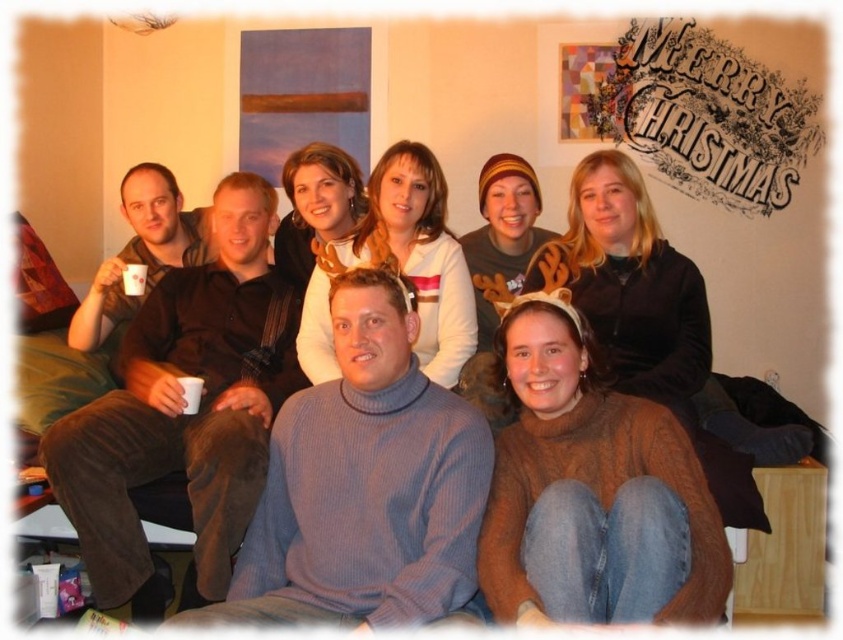
Is ribbed blue sweater at center to the right of brown wool sweater at lower center from the viewer's perspective?

No, ribbed blue sweater at center is not to the right of brown wool sweater at lower center.

Locate an element on the screen. ribbed blue sweater at center is located at coordinates (364, 484).

The height and width of the screenshot is (640, 843). In order to click on ribbed blue sweater at center in this screenshot , I will do `click(364, 484)`.

Between brown corduroy pants at left and brown wool sweater at lower center, which one has more height?

Standing taller between the two is brown corduroy pants at left.

Between brown corduroy pants at left and brown wool sweater at lower center, which one has less height?

brown wool sweater at lower center

This screenshot has height=640, width=843. Describe the element at coordinates (183, 408) in the screenshot. I see `brown corduroy pants at left` at that location.

At what (x,y) coordinates should I click in order to perform the action: click on brown corduroy pants at left. Please return your answer as a coordinate pair (x, y). Image resolution: width=843 pixels, height=640 pixels. Looking at the image, I should click on (183, 408).

Looking at this image, is brown wool sweater at lower center smaller than brown fuzzy sweater at center?

Yes, brown wool sweater at lower center is smaller than brown fuzzy sweater at center.

The height and width of the screenshot is (640, 843). What do you see at coordinates (594, 493) in the screenshot? I see `brown wool sweater at lower center` at bounding box center [594, 493].

Locate an element on the screen. This screenshot has width=843, height=640. brown wool sweater at lower center is located at coordinates (594, 493).